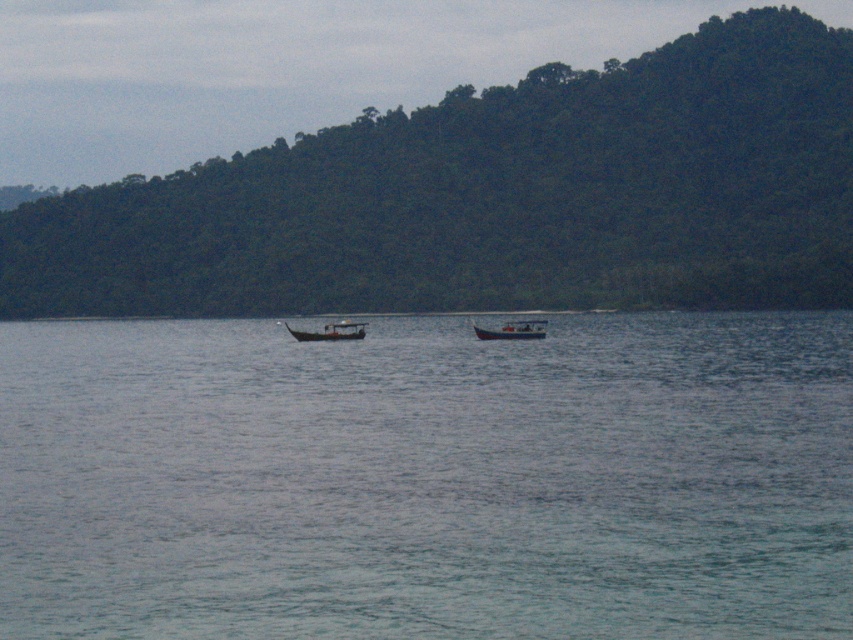
Question: Which is nearer to the white plastic boat at center?

Choices:
 (A) clear water at center
 (B) green leafy hillside at upper center

Answer: (A)

Question: Estimate the real-world distances between objects in this image. Which object is closer to the green leafy hillside at upper center?

Choices:
 (A) white plastic boat at center
 (B) clear water at center
 (C) wooden boat at center

Answer: (B)

Question: Can you confirm if clear water at center is positioned above wooden boat at center?

Choices:
 (A) no
 (B) yes

Answer: (A)

Question: Which object is positioned closest to the white plastic boat at center?

Choices:
 (A) green leafy hillside at upper center
 (B) clear water at center

Answer: (B)

Question: Is green leafy hillside at upper center bigger than wooden boat at center?

Choices:
 (A) yes
 (B) no

Answer: (A)

Question: Is clear water at center above white plastic boat at center?

Choices:
 (A) no
 (B) yes

Answer: (A)